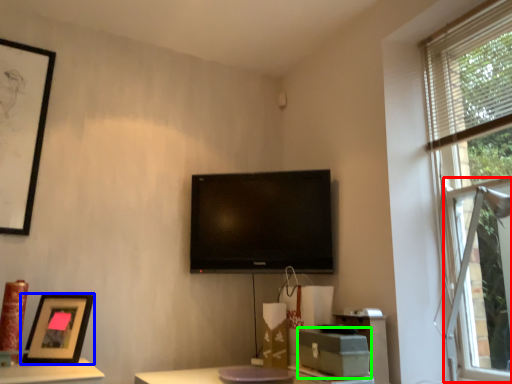
Question: Estimate the real-world distances between objects in this image. Which object is farther from bay window (highlighted by a red box), picture frame (highlighted by a blue box) or cardboard box (highlighted by a green box)?

Choices:
 (A) picture frame
 (B) cardboard box

Answer: (A)